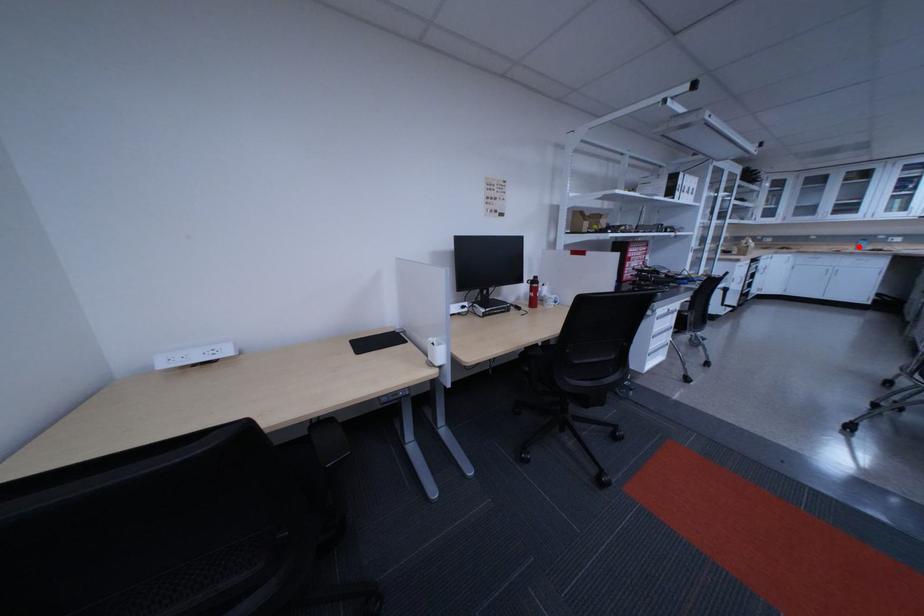
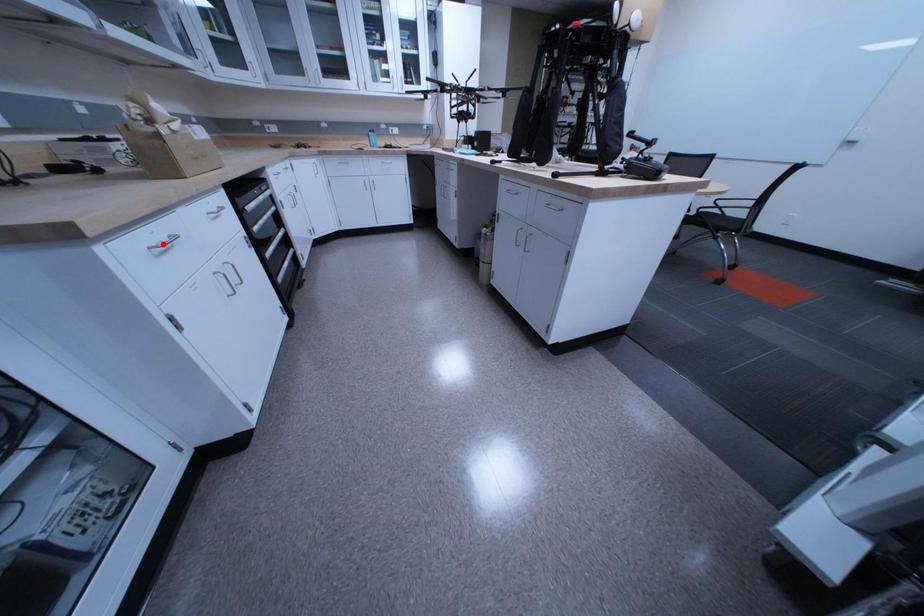
I am providing you with two images of the same scene from different viewpoints. A red point is marked on the first image and another point is marked on the second image. Is the marked point in image1 the same physical position as the marked point in image2?

No